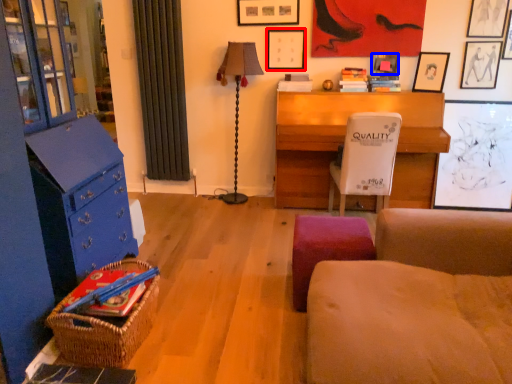
Question: Among these objects, which one is nearest to the camera, picture frame (highlighted by a red box) or picture frame (highlighted by a blue box)?

Choices:
 (A) picture frame
 (B) picture frame

Answer: (B)